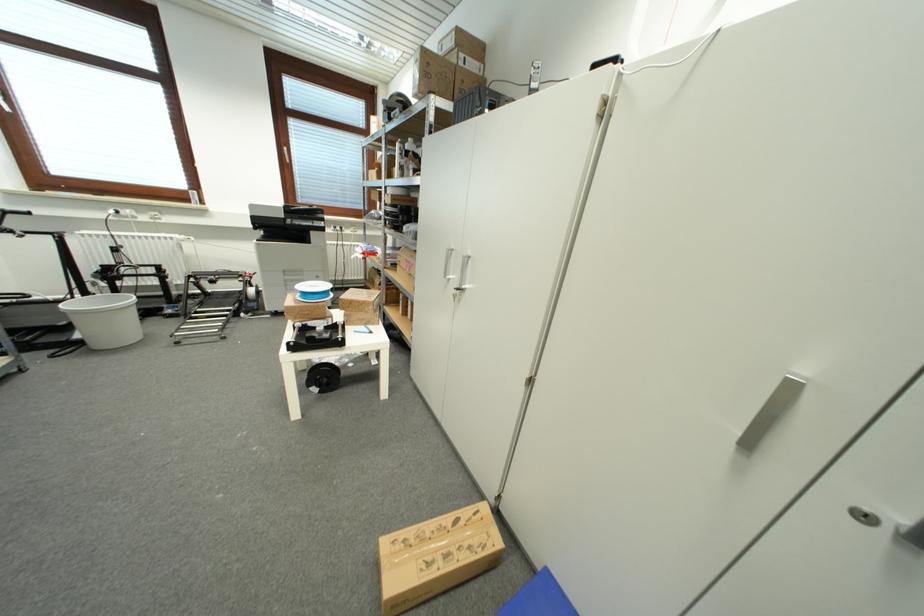
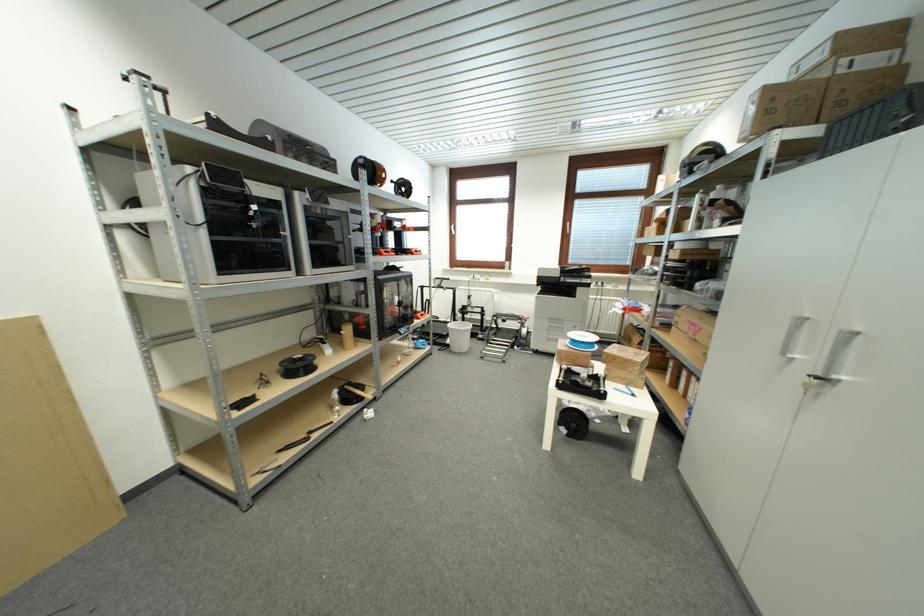
In the second image, find the point that corresponds to (80,339) in the first image.

(453, 344)